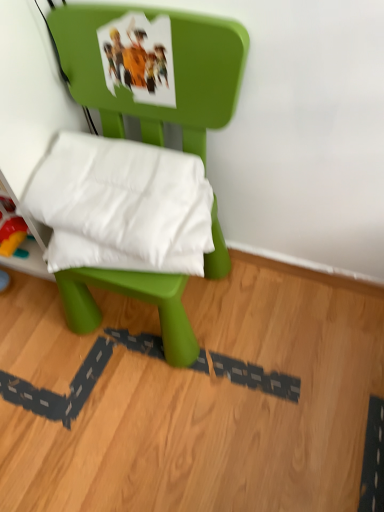
Question: In terms of height, does white soft pillow at center look taller or shorter compared to green plastic chair at center?

Choices:
 (A) tall
 (B) short

Answer: (B)

Question: Based on their positions, is white soft pillow at center located to the left or right of green plastic chair at center?

Choices:
 (A) left
 (B) right

Answer: (A)

Question: Is white soft pillow at center bigger or smaller than green plastic chair at center?

Choices:
 (A) small
 (B) big

Answer: (A)

Question: Is green plastic chair at center to the left or to the right of white soft pillow at center in the image?

Choices:
 (A) left
 (B) right

Answer: (B)

Question: Does point (218, 126) appear closer or farther from the camera than point (92, 230)?

Choices:
 (A) closer
 (B) farther

Answer: (B)

Question: From a real-world perspective, relative to white soft pillow at center, is green plastic chair at center vertically above or below?

Choices:
 (A) below
 (B) above

Answer: (A)

Question: In terms of size, does green plastic chair at center appear bigger or smaller than white soft pillow at center?

Choices:
 (A) small
 (B) big

Answer: (B)